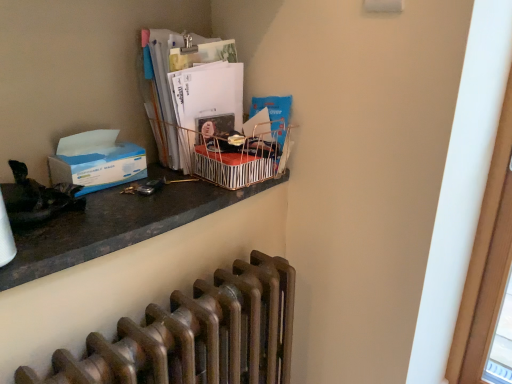
Question: Is bronze metallic radiator at lower center not close to metallic striped basket at upper center?

Choices:
 (A) no
 (B) yes

Answer: (A)

Question: From a real-world perspective, is bronze metallic radiator at lower center over metallic striped basket at upper center?

Choices:
 (A) no
 (B) yes

Answer: (A)

Question: From the image's perspective, is bronze metallic radiator at lower center below metallic striped basket at upper center?

Choices:
 (A) yes
 (B) no

Answer: (A)

Question: From the image's perspective, is bronze metallic radiator at lower center above metallic striped basket at upper center?

Choices:
 (A) no
 (B) yes

Answer: (A)

Question: Is bronze metallic radiator at lower center next to metallic striped basket at upper center and touching it?

Choices:
 (A) yes
 (B) no

Answer: (B)

Question: From the image's perspective, is blue paper at left above or below metallic striped basket at upper center?

Choices:
 (A) above
 (B) below

Answer: (B)

Question: Considering the positions of point (120, 150) and point (282, 168), is point (120, 150) closer or farther from the camera than point (282, 168)?

Choices:
 (A) closer
 (B) farther

Answer: (A)

Question: From a real-world perspective, is blue paper at left physically located above or below metallic striped basket at upper center?

Choices:
 (A) below
 (B) above

Answer: (A)

Question: Is blue paper at left situated inside metallic striped basket at upper center or outside?

Choices:
 (A) outside
 (B) inside

Answer: (A)

Question: From the image's perspective, is matte paper magazine at upper center positioned above or below blue paper at left?

Choices:
 (A) below
 (B) above

Answer: (B)

Question: Is matte paper magazine at upper center in front of or behind blue paper at left in the image?

Choices:
 (A) behind
 (B) front

Answer: (A)

Question: In the image, is matte paper magazine at upper center on the left side or the right side of blue paper at left?

Choices:
 (A) left
 (B) right

Answer: (B)

Question: From a real-world perspective, is matte paper magazine at upper center positioned above or below blue paper at left?

Choices:
 (A) below
 (B) above

Answer: (B)

Question: From the image's perspective, is blue paper at left positioned above or below matte paper magazine at upper center?

Choices:
 (A) above
 (B) below

Answer: (B)

Question: Is blue paper at left wider or thinner than matte paper magazine at upper center?

Choices:
 (A) wide
 (B) thin

Answer: (B)